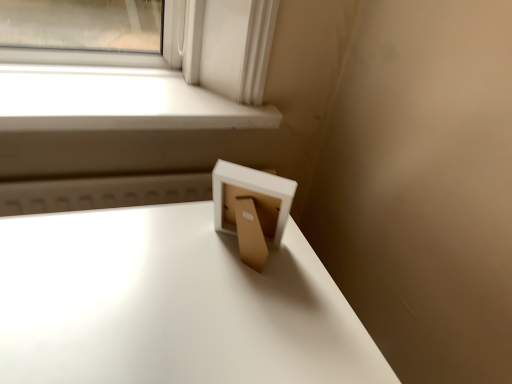
Question: From a real-world perspective, is white matte window sill at upper left above or below white glossy table at center?

Choices:
 (A) above
 (B) below

Answer: (A)

Question: Is white matte window sill at upper left wider or thinner than white glossy table at center?

Choices:
 (A) thin
 (B) wide

Answer: (A)

Question: Is white matte window sill at upper left taller or shorter than white glossy table at center?

Choices:
 (A) short
 (B) tall

Answer: (A)

Question: Would you say white glossy table at center is to the left or to the right of white matte window sill at upper left in the picture?

Choices:
 (A) left
 (B) right

Answer: (B)

Question: Is white glossy table at center taller or shorter than white matte window sill at upper left?

Choices:
 (A) tall
 (B) short

Answer: (A)

Question: From the image's perspective, relative to white matte window sill at upper left, is white glossy table at center above or below?

Choices:
 (A) below
 (B) above

Answer: (A)

Question: Is point (282, 337) positioned closer to the camera than point (238, 34)?

Choices:
 (A) farther
 (B) closer

Answer: (B)